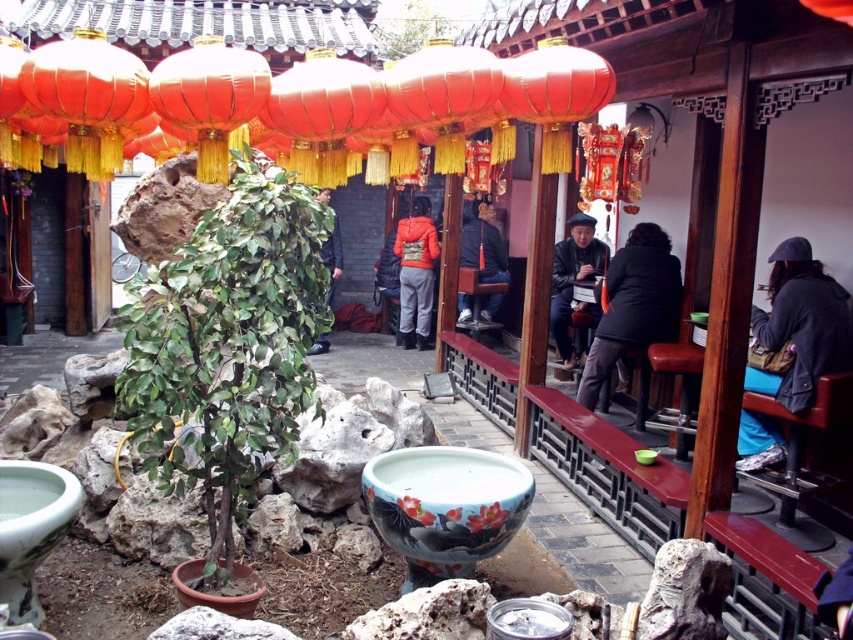
Question: Does matte red lantern at upper center appear over dark gray leather jacket at center?

Choices:
 (A) no
 (B) yes

Answer: (B)

Question: Which object is the closest to the dark gray leather jacket at center?

Choices:
 (A) dark gray jacket at center
 (B) matte red lantern at center
 (C) orange matte jacket at center
 (D) shiny red paper lantern at upper center

Answer: (D)

Question: Among these points, which one is farthest from the camera?

Choices:
 (A) (318, 339)
 (B) (239, 500)
 (C) (242, 67)

Answer: (A)

Question: Is shiny red lantern at upper left wider than shiny red paper lantern at upper center?

Choices:
 (A) no
 (B) yes

Answer: (A)

Question: Is matte red lantern at center positioned in front of shiny red paper lantern at upper center?

Choices:
 (A) no
 (B) yes

Answer: (B)

Question: Which of the following is the closest to the observer?

Choices:
 (A) camouflage fabric jacket at center
 (B) dark gray leather jacket at center

Answer: (B)